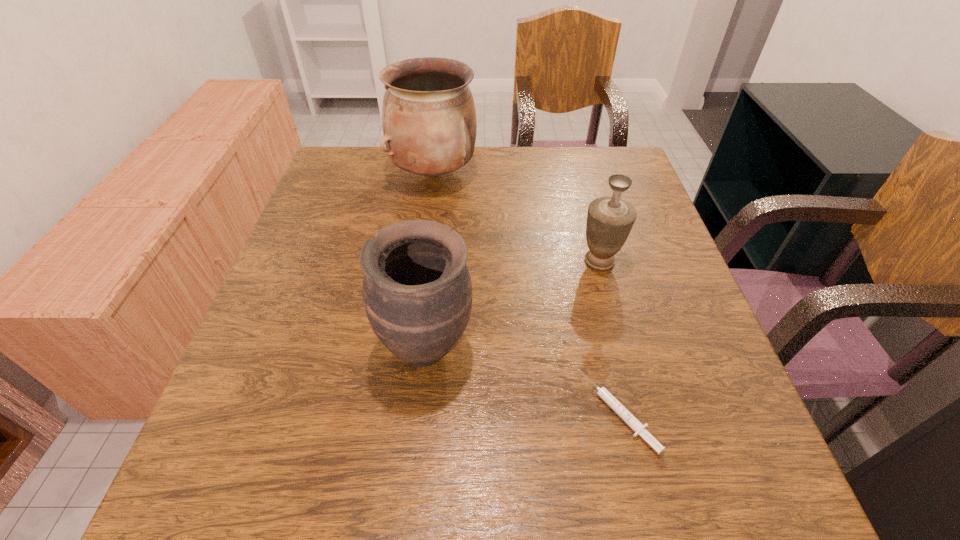
Find the location of a particular element. Image resolution: width=960 pixels, height=540 pixels. the farthest object is located at coordinates (429, 122).

Find the location of a particular element. This screenshot has width=960, height=540. the nearest urn is located at coordinates (417, 291).

Where is `the second farthest object`? Image resolution: width=960 pixels, height=540 pixels. the second farthest object is located at coordinates (610, 219).

This screenshot has height=540, width=960. I want to click on the rightmost urn, so click(610, 219).

Where is `the shortest object`? the shortest object is located at coordinates (603, 393).

Image resolution: width=960 pixels, height=540 pixels. In order to click on vacant space located on the left of the farthest urn in this screenshot , I will do `click(326, 174)`.

Where is `vacant space situated on the right of the nearest urn`? The width and height of the screenshot is (960, 540). vacant space situated on the right of the nearest urn is located at coordinates (631, 348).

Locate an element on the screen. The height and width of the screenshot is (540, 960). free location located on the right of the third tallest object is located at coordinates (657, 261).

At what (x,y) coordinates should I click in order to perform the action: click on vacant space situated on the left of the shortest object. Please return your answer as a coordinate pair (x, y). Looking at the image, I should click on (404, 412).

You are a GUI agent. You are given a task and a screenshot of the screen. Output one action in this format:
    pyautogui.click(x=<x>, y=<y>)
    Task: Click on the object that is at the far edge
    
    Given the screenshot: What is the action you would take?
    pyautogui.click(x=429, y=122)